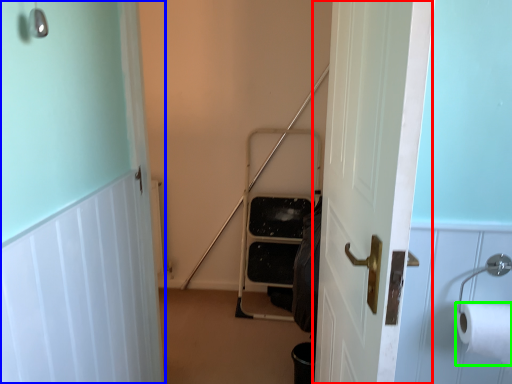
Question: Which is nearer to the door (highlighted by a red box)? door (highlighted by a blue box) or toilet paper (highlighted by a green box).

Choices:
 (A) door
 (B) toilet paper

Answer: (B)